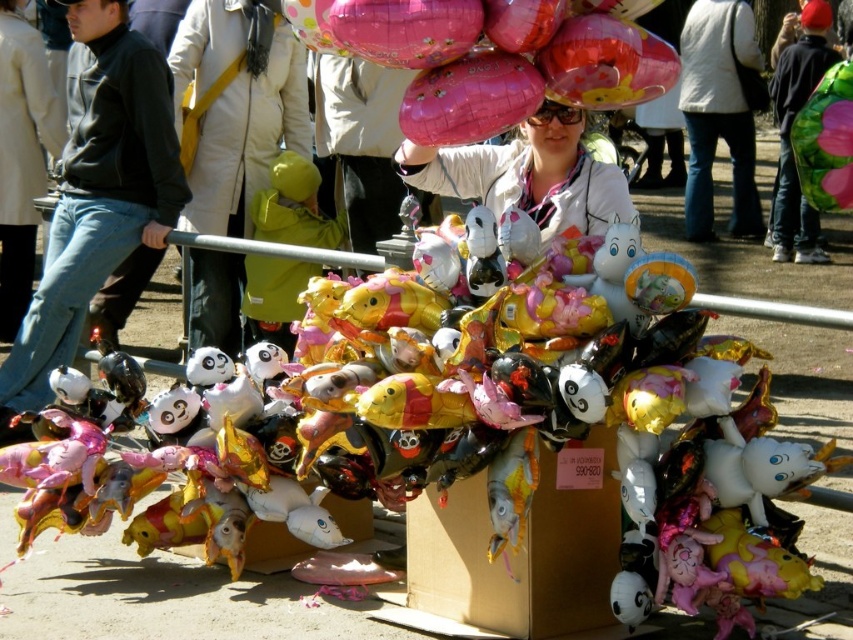
You are standing in front of the balloon vendor and want to know which of the two points, point (427, 3) or point (833, 182), is closer to you. Can you determine this based on the image?

Point (427, 3) is closer to the camera than point (833, 182), so it is closer to you.

You are standing in front of the balloon vendor and notice two points in the scene. The first point is at coordinates point (91, 26) and the second is at point (521, 570). Which point is closer to you?

Point (91, 26) is closer to you because it is further to the camera than point (521, 570).